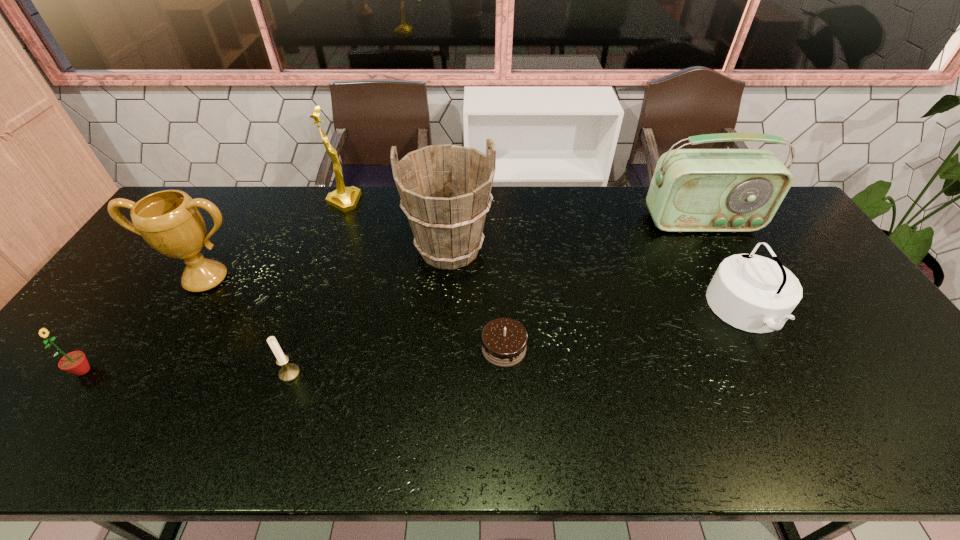
Identify the location of bucket at the far edge. (445, 190).

At what (x,y) coordinates should I click in order to perform the action: click on award at the far edge. Please return your answer as a coordinate pair (x, y). This screenshot has width=960, height=540. Looking at the image, I should click on (345, 199).

The image size is (960, 540). I want to click on radio receiver located at the far edge, so click(x=692, y=190).

Locate an element on the screen. The image size is (960, 540). award that is at the left edge is located at coordinates (169, 221).

You are a GUI agent. You are given a task and a screenshot of the screen. Output one action in this format:
    pyautogui.click(x=<x>, y=<y>)
    Task: Click on the sunflower at the left edge
    This screenshot has height=540, width=960.
    Given the screenshot: What is the action you would take?
    pyautogui.click(x=75, y=362)

Identify the location of object that is positioned at the right edge. pos(692,190).

I want to click on object that is at the far right corner, so click(692, 190).

I want to click on blank space at the far edge, so click(x=294, y=198).

This screenshot has height=540, width=960. I want to click on vacant space at the near edge of the desktop, so click(789, 450).

In the image, there is a desktop. At what (x,y) coordinates should I click in order to perform the action: click on vacant space at the left edge. Please return your answer as a coordinate pair (x, y). The width and height of the screenshot is (960, 540). Looking at the image, I should click on (161, 261).